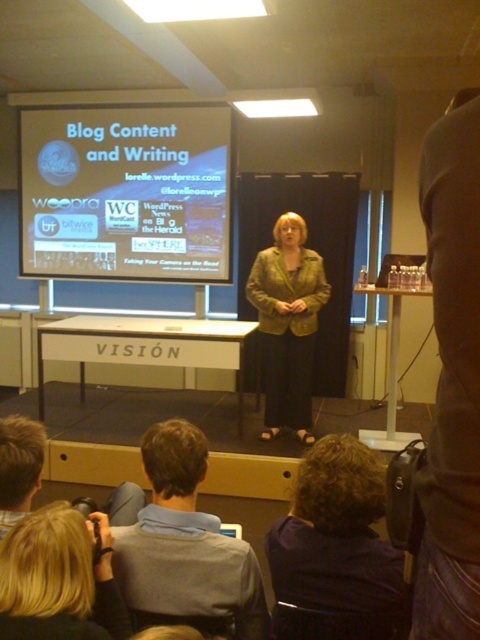
You are a photographer standing at the back of the room. You want to take a photo of the woman on stage so that both the dark blue fabric at lower center and the blonde hair at lower left are clearly visible in the frame. Given that your camera has a minimum focus distance of 50 centimeters, will you be able to capture both objects in focus at the same time?

The distance between the dark blue fabric at lower center and blonde hair at lower left is 48.35 centimeters. Since the camera requires a minimum focus distance of 50 centimeters to keep both objects in focus simultaneously, the photographer cannot capture both in focus at the same time because the actual distance is shorter than the required minimum focus distance.